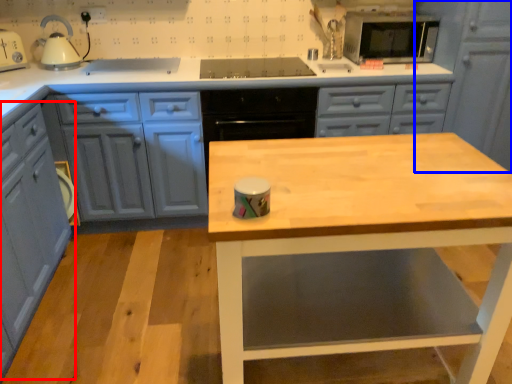
Question: Among these objects, which one is nearest to the camera, cabinetry (highlighted by a red box) or cabinetry (highlighted by a blue box)?

Choices:
 (A) cabinetry
 (B) cabinetry

Answer: (A)